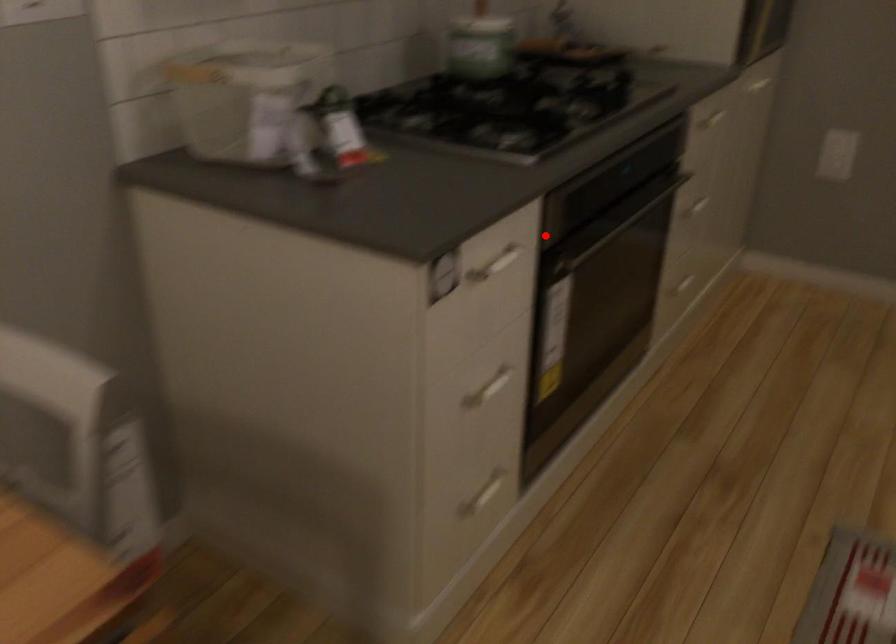
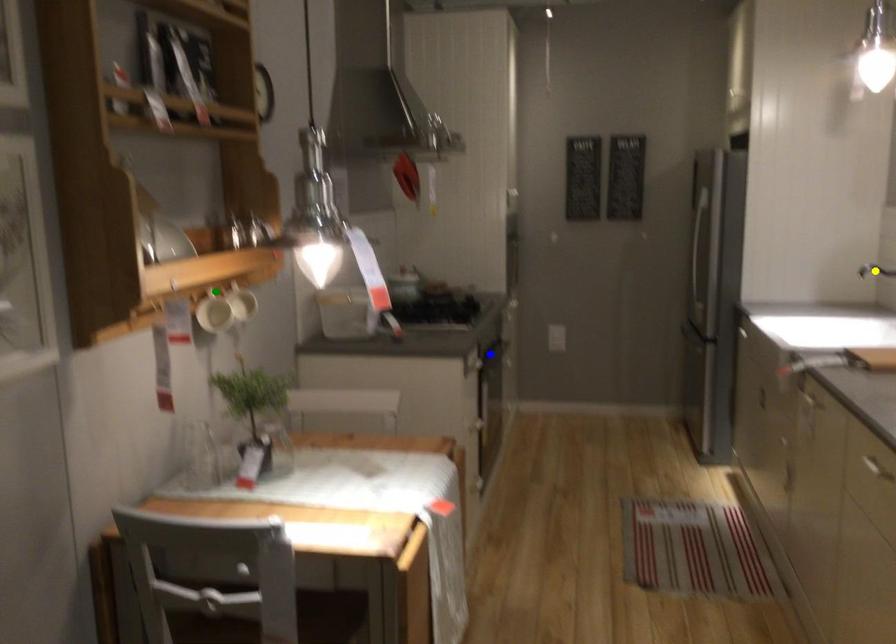
Question: I am providing you with two images of the same scene from different viewpoints. A red point is marked on the first image. You are given multiple points on the second image. In image 2, which mark is for the same physical point as the one in image 1?

Choices:
 (A) yellow point
 (B) green point
 (C) blue point

Answer: (C)